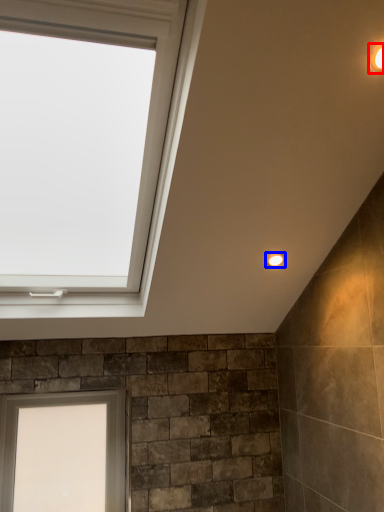
Question: Which point is further to the camera, light fixture (highlighted by a red box) or light fixture (highlighted by a blue box)?

Choices:
 (A) light fixture
 (B) light fixture

Answer: (B)